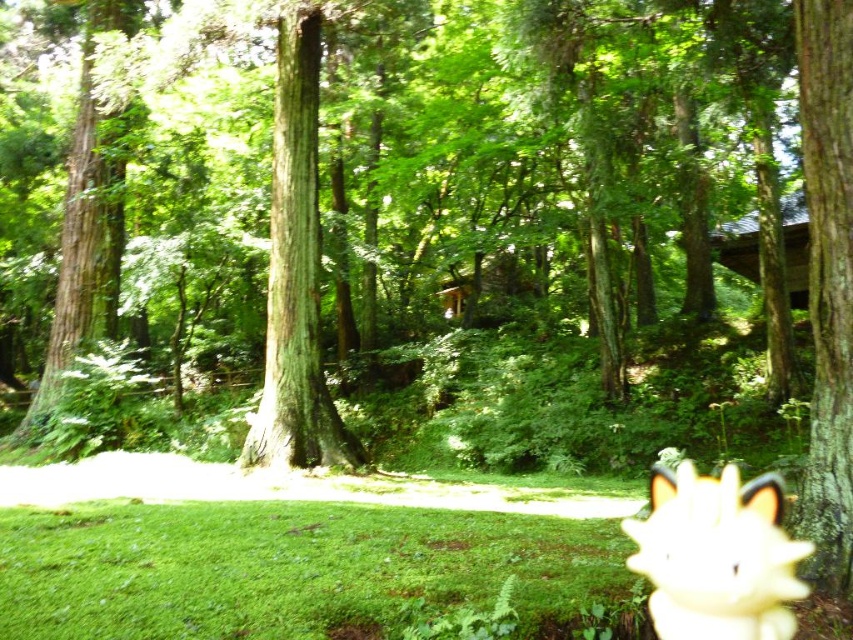
Question: Among these points, which one is nearest to the camera?

Choices:
 (A) (827, 243)
 (B) (735, 518)

Answer: (B)

Question: Can you confirm if green rough bark tree at right is positioned below white fluffy dog at lower right?

Choices:
 (A) yes
 (B) no

Answer: (B)

Question: Is green rough bark tree at right below white fluffy dog at lower right?

Choices:
 (A) yes
 (B) no

Answer: (B)

Question: Among these objects, which one is farthest from the camera?

Choices:
 (A) green rough bark tree at right
 (B) white fluffy dog at lower right

Answer: (A)

Question: Is green rough bark tree at right further to camera compared to white fluffy dog at lower right?

Choices:
 (A) no
 (B) yes

Answer: (B)

Question: Which point appears closest to the camera in this image?

Choices:
 (A) (807, 86)
 (B) (779, 572)

Answer: (B)